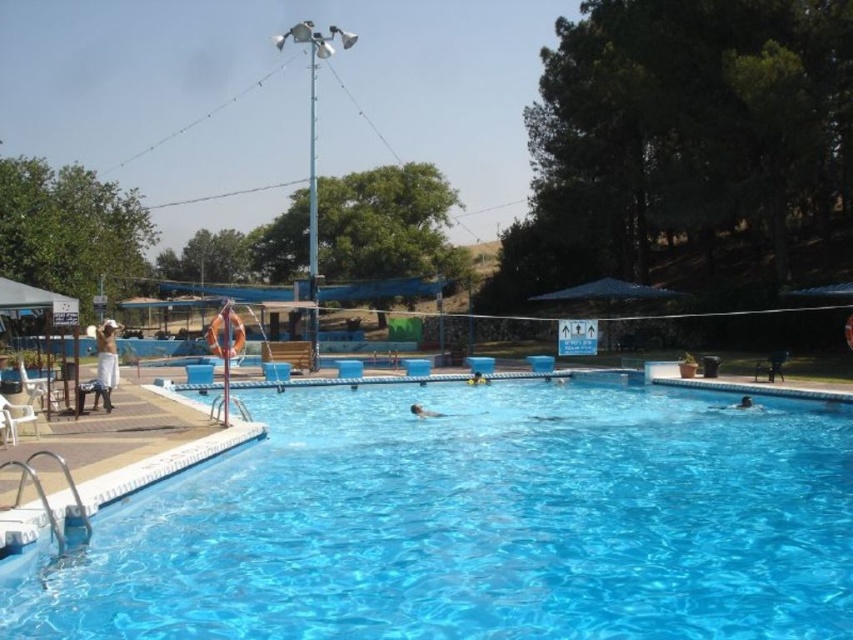
Consider the image. Between smooth skin person at center and smooth blue swimmer at center, which one is positioned higher?

Positioned higher is smooth blue swimmer at center.

Between point (421, 412) and point (480, 380), which one is positioned behind?

The point (480, 380) is more distant.

Locate an element on the screen. The height and width of the screenshot is (640, 853). smooth skin person at center is located at coordinates (422, 412).

What do you see at coordinates (482, 524) in the screenshot? The image size is (853, 640). I see `transparent blue water at center` at bounding box center [482, 524].

Which is more to the left, transparent blue water at center or white towel at left?

From the viewer's perspective, white towel at left appears more on the left side.

Consider the image. Who is more distant from viewer, [251,525] or [105,385]?

Positioned behind is point [105,385].

At what (x,y) coordinates should I click in order to perform the action: click on transparent blue water at center. Please return your answer as a coordinate pair (x, y). The height and width of the screenshot is (640, 853). Looking at the image, I should click on (482, 524).

Is point (99, 368) in front of point (482, 376)?

Yes, it is.

Where is `white towel at left`? white towel at left is located at coordinates (106, 358).

Is point (102, 340) more distant than point (483, 380)?

No, (102, 340) is in front of (483, 380).

At what (x,y) coordinates should I click in order to perform the action: click on white towel at left. Please return your answer as a coordinate pair (x, y). This screenshot has height=640, width=853. Looking at the image, I should click on (106, 358).